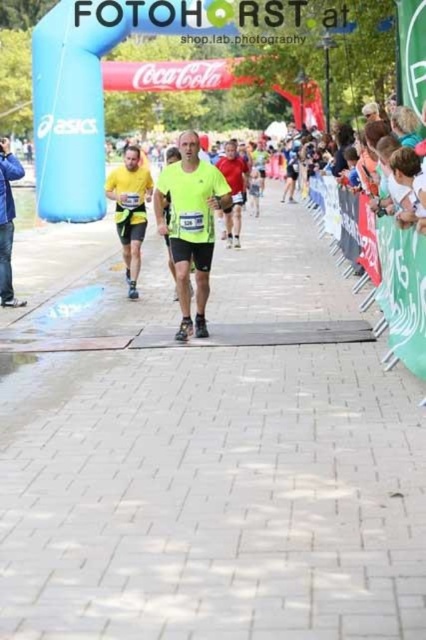
Question: Does neon yellow running shirt at center appear on the left side of matte blue jacket at left?

Choices:
 (A) yes
 (B) no

Answer: (B)

Question: Does neon yellow running shirt at center come in front of matte blue jacket at left?

Choices:
 (A) no
 (B) yes

Answer: (B)

Question: Which object appears farthest from the camera in this image?

Choices:
 (A) matte blue jacket at left
 (B) matte red shirt at center
 (C) neon yellow running shirt at center

Answer: (A)

Question: From the image, what is the correct spatial relationship of neon yellow running shirt at center in relation to matte blue jacket at left?

Choices:
 (A) left
 (B) right

Answer: (B)

Question: Which of the following is the closest to the observer?

Choices:
 (A) (x=0, y=182)
 (B) (x=198, y=289)

Answer: (B)

Question: Among these objects, which one is farthest from the camera?

Choices:
 (A) matte red shirt at center
 (B) matte blue jacket at left
 (C) neon yellow running shirt at center

Answer: (B)